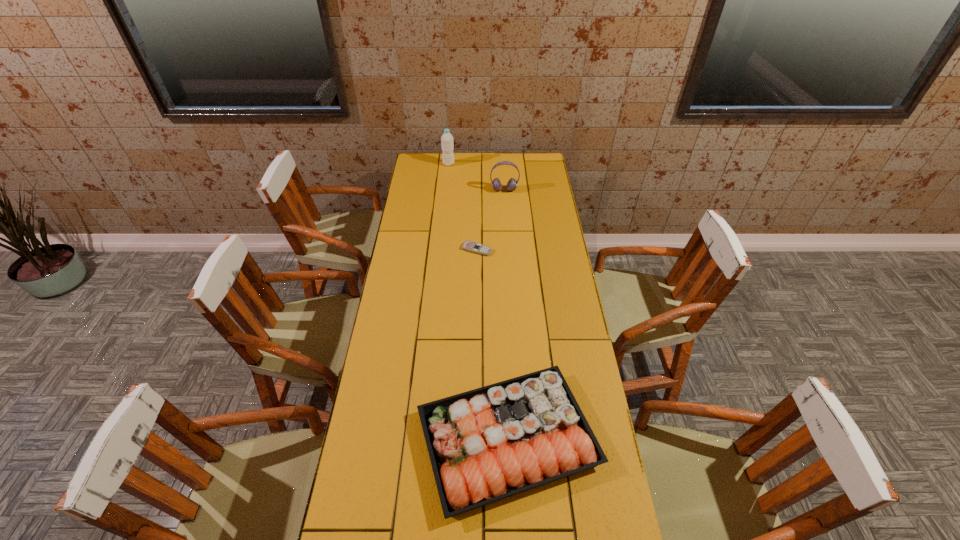
This screenshot has height=540, width=960. Find the location of `vacant space that is in between the shortest object and the water bottle`. vacant space that is in between the shortest object and the water bottle is located at coordinates (463, 207).

Locate an element on the screen. This screenshot has height=540, width=960. vacant point located between the headset and the water bottle is located at coordinates (476, 177).

Where is `empty location between the shortest object and the third tallest object`? Image resolution: width=960 pixels, height=540 pixels. empty location between the shortest object and the third tallest object is located at coordinates (492, 344).

This screenshot has width=960, height=540. I want to click on unoccupied position between the third shortest object and the shortest object, so click(x=491, y=220).

You are a GUI agent. You are given a task and a screenshot of the screen. Output one action in this format:
    pyautogui.click(x=<x>, y=<y>)
    Task: Click on the vacant point located between the second farthest object and the nearest object
    The height and width of the screenshot is (540, 960).
    Given the screenshot: What is the action you would take?
    pyautogui.click(x=506, y=314)

Find the location of `free space between the second farthest object and the second shortest object`. free space between the second farthest object and the second shortest object is located at coordinates (506, 314).

The height and width of the screenshot is (540, 960). I want to click on the third closest object to the tallest object, so click(x=487, y=444).

Select which object is the closest to the shortest object. Please provide its 2D coordinates. Your answer should be formatted as a tuple, i.e. [(x, y)], where the tuple contains the x and y coordinates of a point satisfying the conditions above.

[(512, 183)]